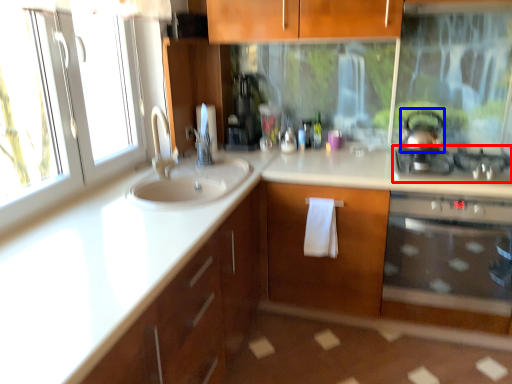
Question: Which object is closer to the camera taking this photo, gas stove (highlighted by a red box) or tea pot (highlighted by a blue box)?

Choices:
 (A) gas stove
 (B) tea pot

Answer: (A)